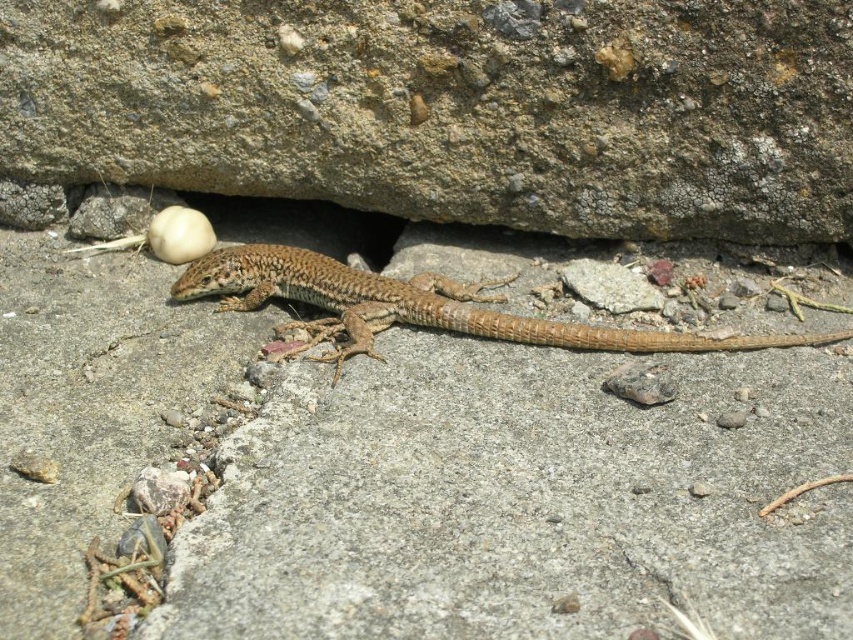
You are standing in front of the lizard on the concrete surface. Where is the brown rough stone at upper center located in relation to the lizard?

The brown rough stone at upper center is located at the coordinates point (451, 108) in the image.